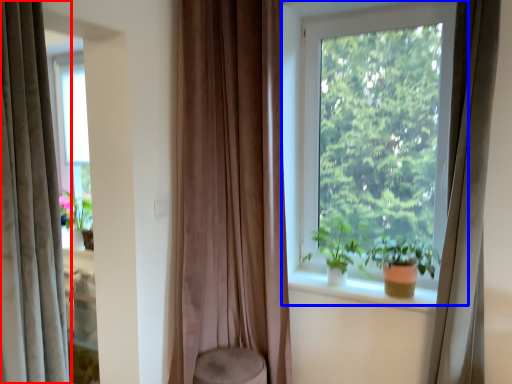
Question: Among these objects, which one is nearest to the camera, curtain (highlighted by a red box) or window (highlighted by a blue box)?

Choices:
 (A) curtain
 (B) window

Answer: (A)